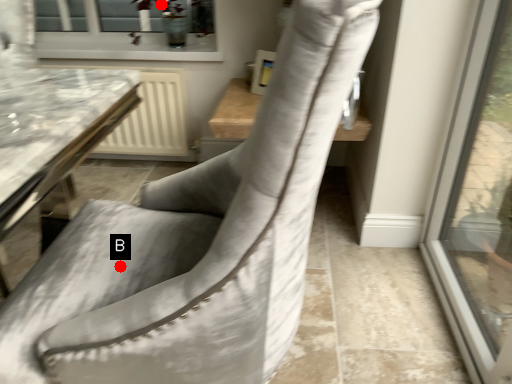
Question: Two points are circled on the image, labeled by A and B beside each circle. Which of the following is the closest to the observer?

Choices:
 (A) A is closer
 (B) B is closer

Answer: (B)